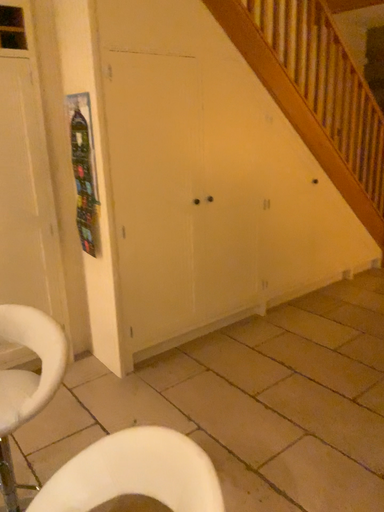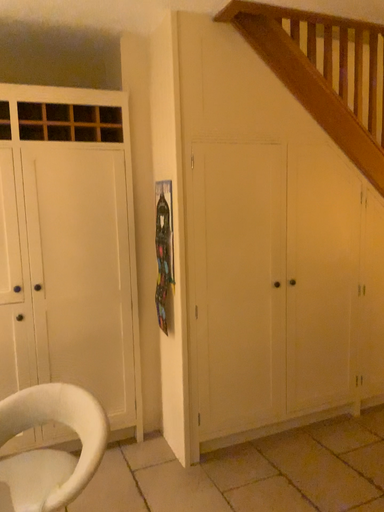
Question: Which way did the camera rotate in the video?

Choices:
 (A) rotated right
 (B) rotated left

Answer: (B)